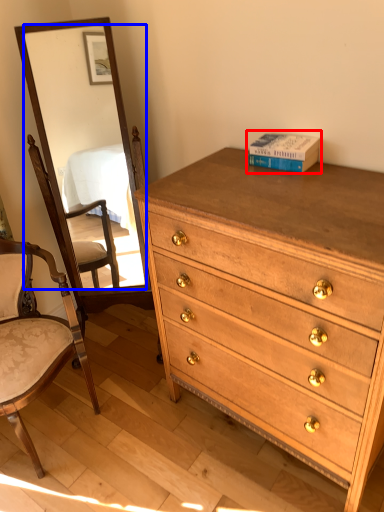
Question: Which object appears farthest to the camera in this image, book (highlighted by a red box) or mirror (highlighted by a blue box)?

Choices:
 (A) book
 (B) mirror

Answer: (A)